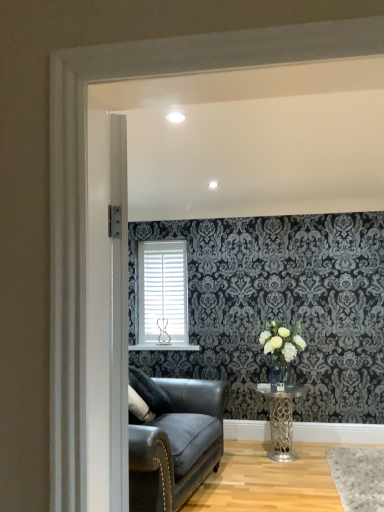
Question: From the image's perspective, does metallic silver table at lower center appear lower than white matte vase at center-right?

Choices:
 (A) no
 (B) yes

Answer: (B)

Question: From a real-world perspective, is metallic silver table at lower center over white matte vase at center-right?

Choices:
 (A) no
 (B) yes

Answer: (A)

Question: Can you confirm if metallic silver table at lower center is bigger than white matte vase at center-right?

Choices:
 (A) no
 (B) yes

Answer: (B)

Question: Is metallic silver table at lower center positioned with its back to white matte vase at center-right?

Choices:
 (A) yes
 (B) no

Answer: (B)

Question: Is metallic silver table at lower center at the left side of white matte vase at center-right?

Choices:
 (A) yes
 (B) no

Answer: (A)

Question: Which is correct: metallic silver table at lower center is inside clear glass vase at center, or outside of it?

Choices:
 (A) inside
 (B) outside

Answer: (B)

Question: Is point (269, 455) closer or farther from the camera than point (273, 375)?

Choices:
 (A) closer
 (B) farther

Answer: (A)

Question: From a real-world perspective, is metallic silver table at lower center positioned above or below clear glass vase at center?

Choices:
 (A) below
 (B) above

Answer: (A)

Question: Looking at their shapes, would you say metallic silver table at lower center is wider or thinner than clear glass vase at center?

Choices:
 (A) thin
 (B) wide

Answer: (B)

Question: Is metallic silver table at lower center wider or thinner than white matte blinds at center?

Choices:
 (A) thin
 (B) wide

Answer: (B)

Question: From a real-world perspective, is metallic silver table at lower center above or below white matte blinds at center?

Choices:
 (A) above
 (B) below

Answer: (B)

Question: From the image's perspective, is metallic silver table at lower center located above or below white matte blinds at center?

Choices:
 (A) below
 (B) above

Answer: (A)

Question: Based on their positions, is metallic silver table at lower center located to the left or right of white matte blinds at center?

Choices:
 (A) left
 (B) right

Answer: (B)

Question: Is point (261, 344) positioned closer to the camera than point (168, 291)?

Choices:
 (A) closer
 (B) farther

Answer: (A)

Question: Would you say white matte vase at center-right is to the left or to the right of white matte blinds at center in the picture?

Choices:
 (A) right
 (B) left

Answer: (A)